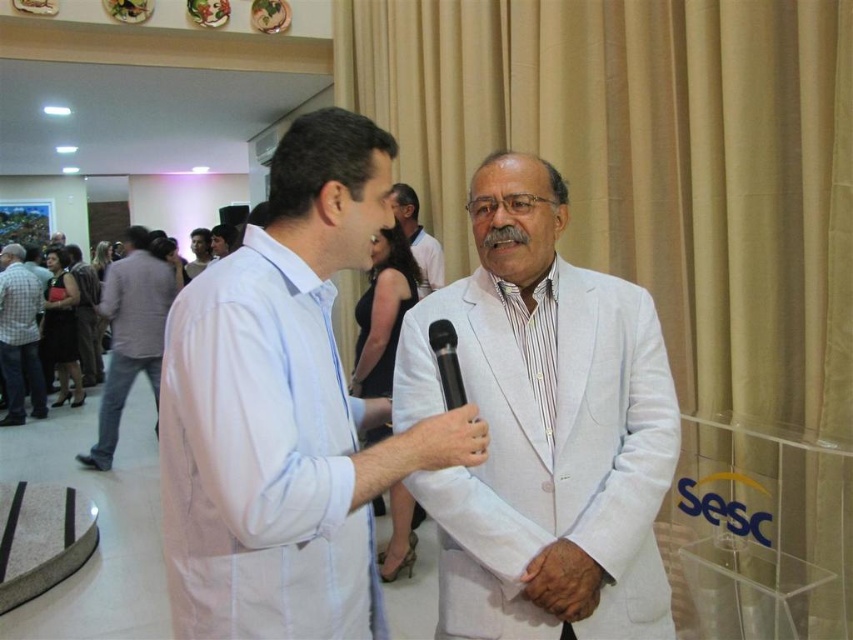
Question: Which point appears closest to the camera in this image?

Choices:
 (A) (440, 252)
 (B) (341, 417)
 (C) (190, 248)
 (D) (222, 237)

Answer: (B)

Question: Can you confirm if black plastic microphone at center is positioned to the left of light blue shirt at center?

Choices:
 (A) yes
 (B) no

Answer: (B)

Question: Among these points, which one is nearest to the camera?

Choices:
 (A) (434, 336)
 (B) (165, 269)

Answer: (A)

Question: Estimate the real-world distances between objects in this image. Which object is closer to the white linen suit at center?

Choices:
 (A) black plastic microphone at center
 (B) light blue shirt at center

Answer: (A)

Question: Where is gray checkered shirt at left located in relation to white textured suit at center in the image?

Choices:
 (A) left
 (B) right

Answer: (A)

Question: Observing the image, what is the correct spatial positioning of white textured suit at center in reference to light blue shirt at center?

Choices:
 (A) below
 (B) above

Answer: (A)